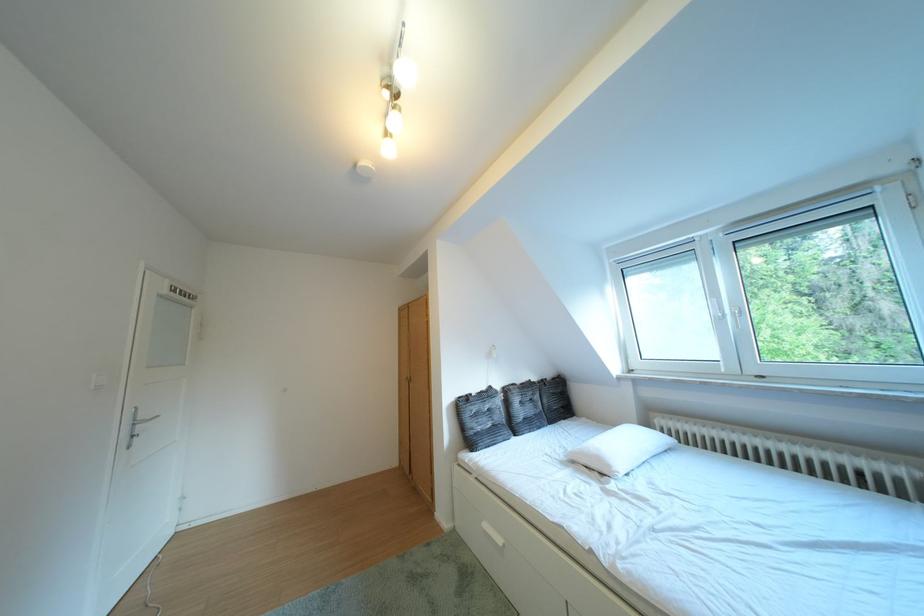
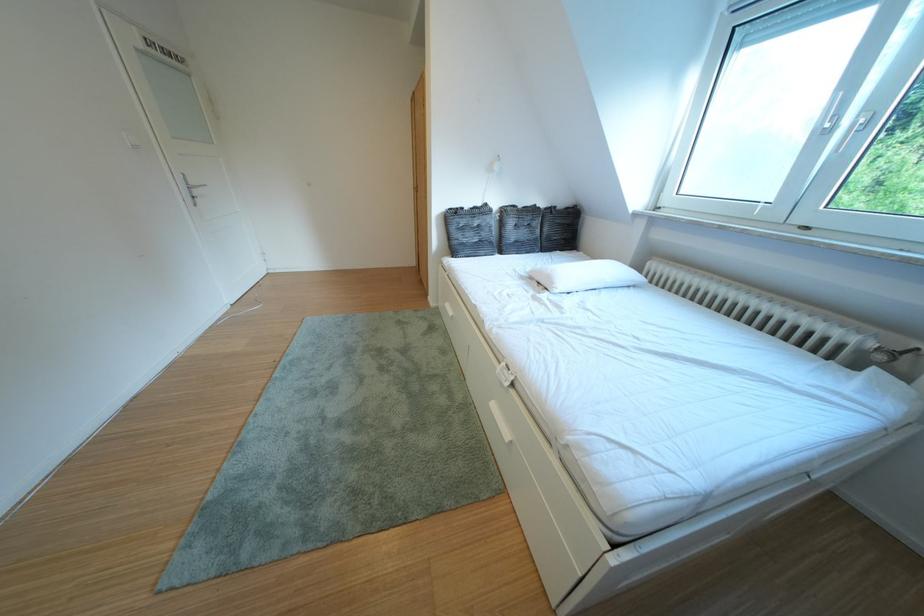
The point at (623, 471) is marked in the first image. Where is the corresponding point in the second image?

(565, 288)